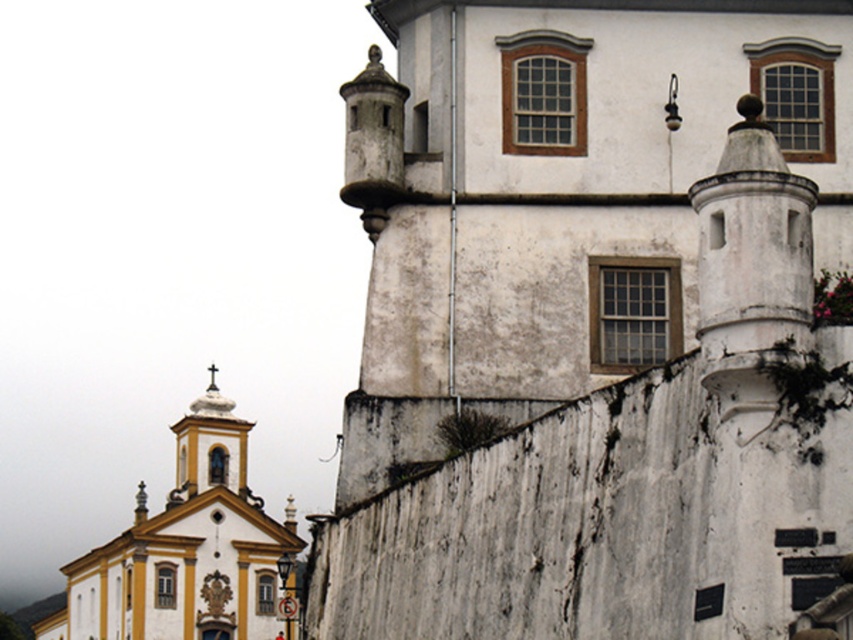
Question: Which of the following is the farthest from the observer?

Choices:
 (A) (390, 474)
 (B) (228, 532)

Answer: (B)

Question: Is white weathered stone church at center further to camera compared to yellow matte church at upper left?

Choices:
 (A) no
 (B) yes

Answer: (A)

Question: Does white weathered stone church at center have a lesser width compared to yellow matte church at upper left?

Choices:
 (A) yes
 (B) no

Answer: (A)

Question: Which of the following is the closest to the observer?

Choices:
 (A) yellow matte church at upper left
 (B) white weathered stone church at center

Answer: (B)

Question: Which point is closer to the camera taking this photo?

Choices:
 (A) click(234, 477)
 (B) click(502, 468)

Answer: (B)

Question: From the image, what is the correct spatial relationship of white weathered stone church at center in relation to yellow matte church at upper left?

Choices:
 (A) above
 (B) below

Answer: (A)